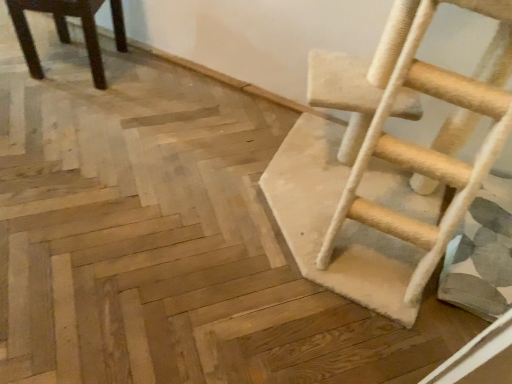
The height and width of the screenshot is (384, 512). Find the location of `free space in front of beige carpeted ladder at right`. free space in front of beige carpeted ladder at right is located at coordinates (297, 329).